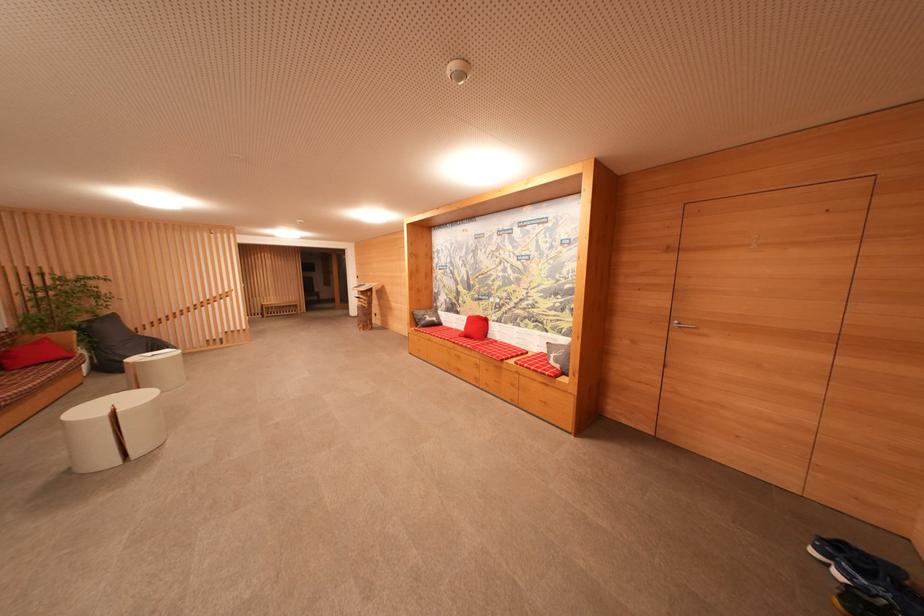
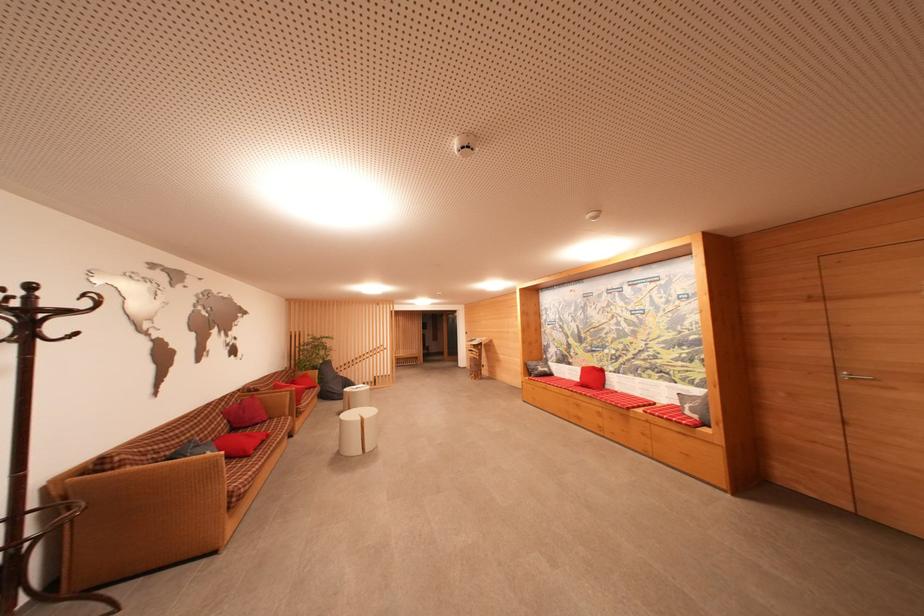
Which direction would the cameraman need to move to produce the second image?

The cameraman walked toward left, backward.